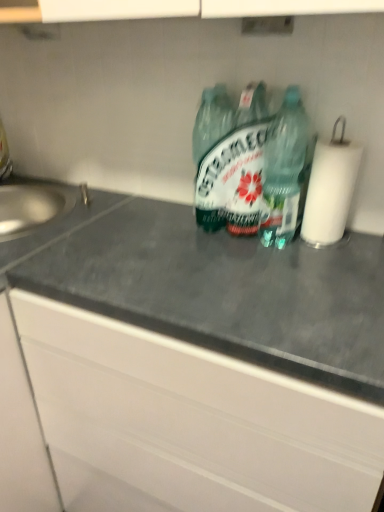
Question: Is gray matte countertop at center at the back of satin silver sink at left?

Choices:
 (A) no
 (B) yes

Answer: (A)

Question: Is satin silver sink at left thinner than gray matte countertop at center?

Choices:
 (A) yes
 (B) no

Answer: (A)

Question: Is satin silver sink at left closer to the viewer compared to gray matte countertop at center?

Choices:
 (A) no
 (B) yes

Answer: (A)

Question: Is satin silver sink at left far away from gray matte countertop at center?

Choices:
 (A) no
 (B) yes

Answer: (A)

Question: Can you confirm if satin silver sink at left is wider than gray matte countertop at center?

Choices:
 (A) yes
 (B) no

Answer: (B)

Question: Is satin silver sink at left bigger than gray matte countertop at center?

Choices:
 (A) no
 (B) yes

Answer: (A)

Question: Is white paper at right surrounded by green translucent bottle at center, which appears as the second bottle when viewed from the left?

Choices:
 (A) yes
 (B) no

Answer: (B)

Question: Does green translucent bottle at center, which appears as the second bottle when viewed from the left, appear on the right side of white paper at right?

Choices:
 (A) no
 (B) yes

Answer: (A)

Question: Is green translucent bottle at center, which appears as the second bottle when viewed from the left, at the left side of white paper at right?

Choices:
 (A) yes
 (B) no

Answer: (A)

Question: From a real-world perspective, does green translucent bottle at center, which appears as the second bottle when viewed from the left, sit lower than white paper at right?

Choices:
 (A) no
 (B) yes

Answer: (A)

Question: Does green translucent bottle at center, which appears as the second bottle when viewed from the left, have a greater width compared to white paper at right?

Choices:
 (A) yes
 (B) no

Answer: (B)

Question: Does green translucent bottle at center, which appears as the second bottle when viewed from the left, have a smaller size compared to white paper at right?

Choices:
 (A) yes
 (B) no

Answer: (A)

Question: From a real-world perspective, is green glass bottle at center, positioned as the 1th bottle in left-to-right order, located beneath satin silver sink at left?

Choices:
 (A) yes
 (B) no

Answer: (B)